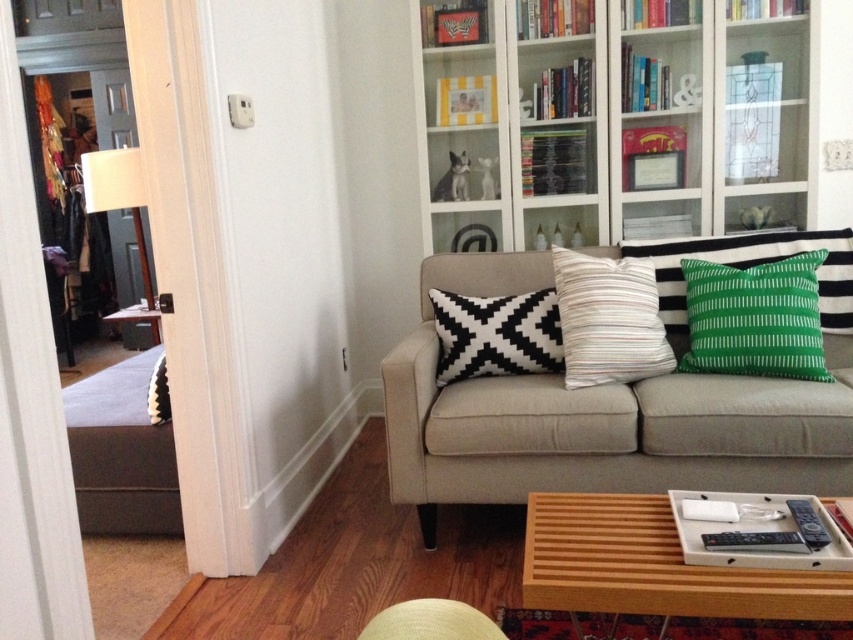
Question: Which is farther from the green striped pillow at right?

Choices:
 (A) black and white woven pillow at center
 (B) white fabric lamp at left
 (C) white striped pillow at center
 (D) white glass bookcase at upper center

Answer: (B)

Question: Which point appears farthest from the camera in this image?

Choices:
 (A) (451, 307)
 (B) (722, 275)

Answer: (A)

Question: Does white striped pillow at center have a smaller size compared to white fabric lamp at left?

Choices:
 (A) yes
 (B) no

Answer: (A)

Question: Among these objects, which one is farthest from the camera?

Choices:
 (A) green striped pillow at right
 (B) white fabric lamp at left
 (C) beige fabric couch at center

Answer: (B)

Question: Is the position of green striped pillow at right more distant than that of white fabric lamp at left?

Choices:
 (A) yes
 (B) no

Answer: (B)

Question: In this image, where is beige fabric couch at center located relative to white fabric lamp at left?

Choices:
 (A) above
 (B) below

Answer: (B)